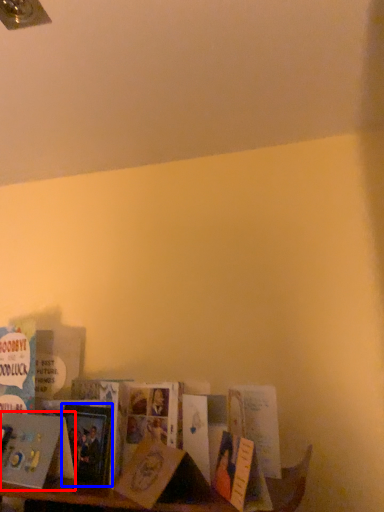
Question: Which object is closer to the camera taking this photo, book (highlighted by a red box) or paperback book (highlighted by a blue box)?

Choices:
 (A) book
 (B) paperback book

Answer: (A)